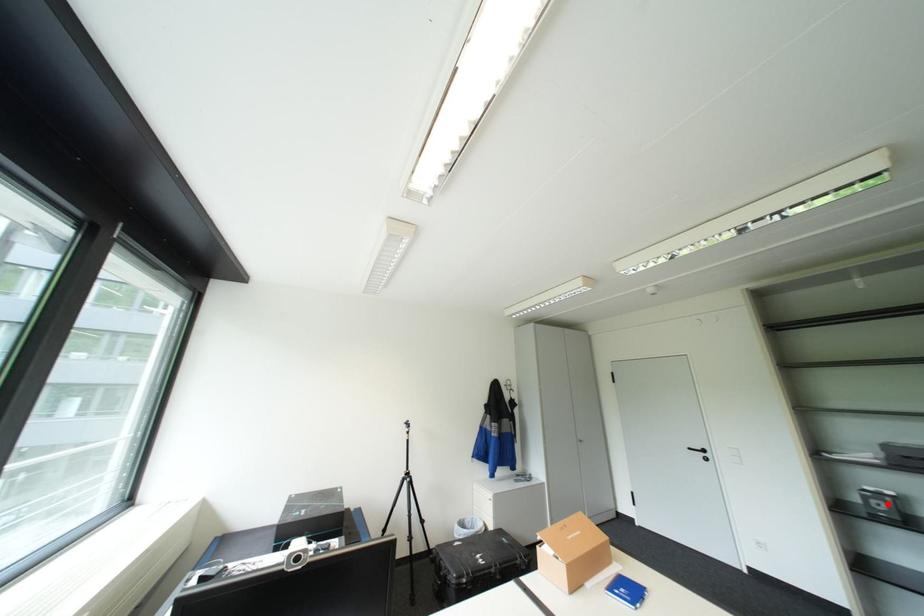
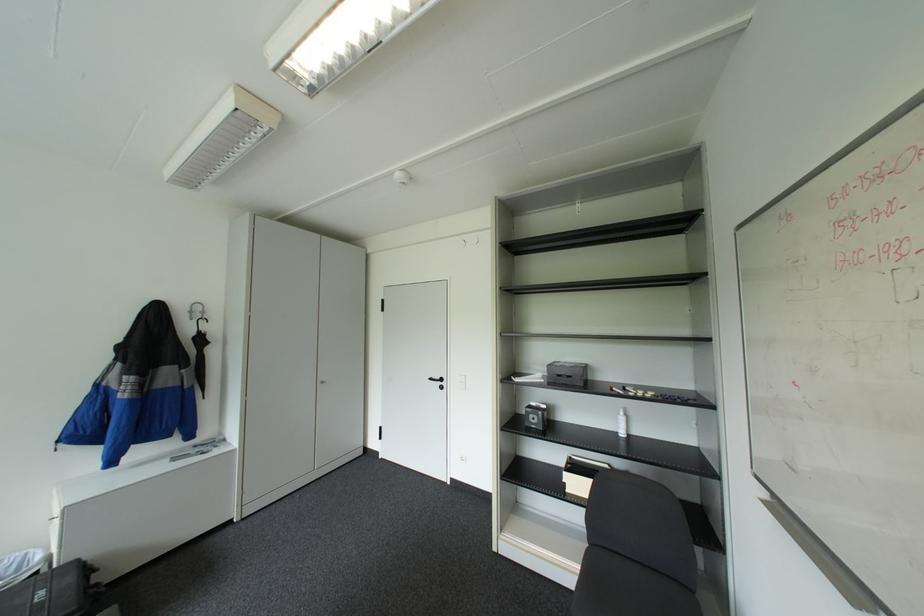
Where in the second image is the point corresponding to the highlighted location from the first image?

(541, 416)